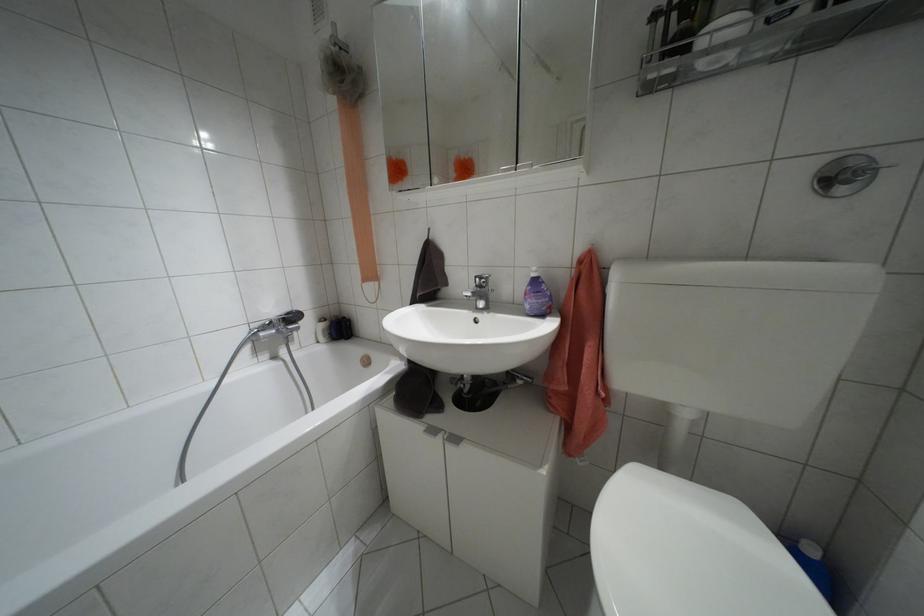
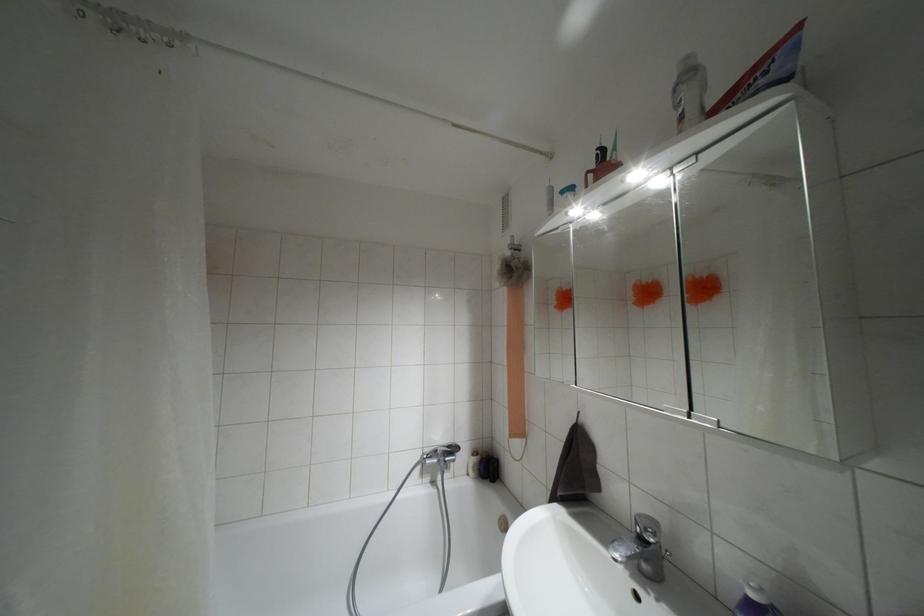
Where in the second image is the point corresponding to point 532,274 from the first image?

(751, 594)